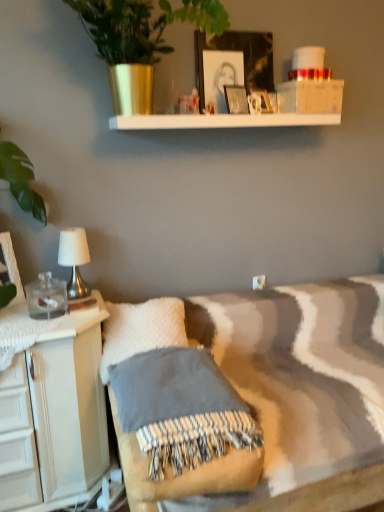
Question: From the image's perspective, is white fabric-covered lamp at left above or below matte white picture frame at left, the fourth picture frame positioned from the top?

Choices:
 (A) below
 (B) above

Answer: (B)

Question: Considering the relative positions of white fabric-covered lamp at left and matte white picture frame at left, placed as the 1th picture frame when sorted from left to right, in the image provided, is white fabric-covered lamp at left to the left or to the right of matte white picture frame at left, placed as the 1th picture frame when sorted from left to right,?

Choices:
 (A) right
 (B) left

Answer: (A)

Question: Considering the real-world distances, which object is farthest from the textured wool blanket at center?

Choices:
 (A) white fluffy pillow at lower left
 (B) matte white picture frame at upper center, marked as the 2th picture frame in a top-to-bottom arrangement
 (C) matte glass picture frame at upper center, marked as the 2th picture frame in a bottom-to-top arrangement
 (D) metallic green plant at upper center
 (E) matte black picture frame at upper center, which is the 3th picture frame in left-to-right order

Answer: (E)

Question: Which of these objects is positioned closest to the metallic green plant at upper center?

Choices:
 (A) matte white picture frame at upper center, which ranks as the 4th picture frame in left-to-right order
 (B) matte glass picture frame at upper center, which ranks as the second picture frame in left-to-right order
 (C) textured wool blanket at center
 (D) white fluffy pillow at lower left
 (E) matte black picture frame at upper center, which is the first picture frame from top to bottom

Answer: (E)